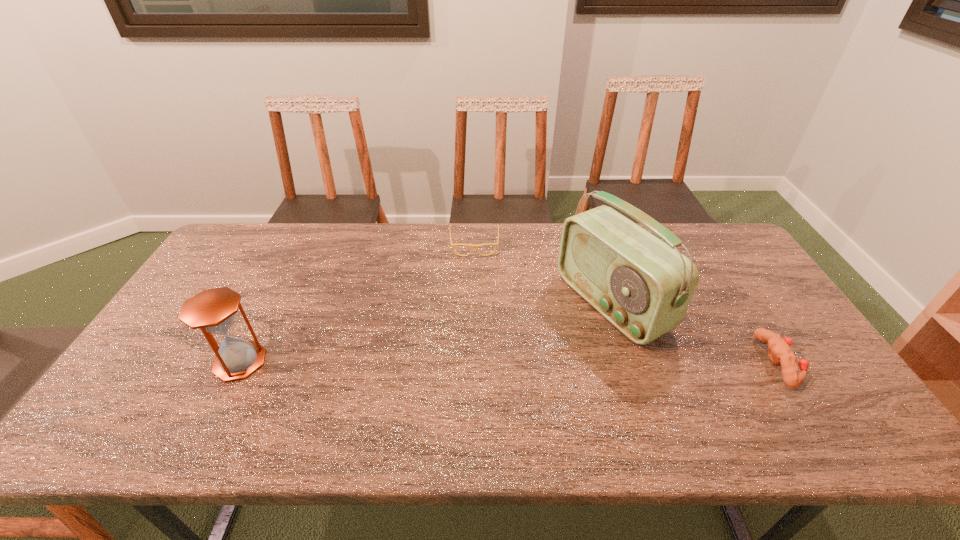
I want to click on vacant space that's between the hourglass and the third object from right to left, so click(357, 303).

At what (x,y) coordinates should I click in order to perform the action: click on free area in between the farthest object and the hourglass. Please return your answer as a coordinate pair (x, y). The width and height of the screenshot is (960, 540). Looking at the image, I should click on (357, 303).

The height and width of the screenshot is (540, 960). Identify the location of free space between the rightmost object and the radio receiver. (695, 333).

Identify the location of free space between the hourglass and the second shortest object. The width and height of the screenshot is (960, 540). (509, 362).

Where is `empty space between the leftmost object and the farthest object`? Image resolution: width=960 pixels, height=540 pixels. empty space between the leftmost object and the farthest object is located at coordinates (357, 303).

In order to click on vacant space that's between the puncher and the second tallest object in this screenshot , I will do `click(509, 362)`.

At what (x,y) coordinates should I click in order to perform the action: click on object that is the closest to the second tallest object. Please return your answer as a coordinate pair (x, y). The image size is (960, 540). Looking at the image, I should click on (496, 244).

Find the location of `object that ranks as the second closest to the second object from right to left`. object that ranks as the second closest to the second object from right to left is located at coordinates (779, 351).

The image size is (960, 540). Find the location of `free spot that satisfies the following two spatial constraints: 1. on the front side of the second shortest object; 2. with the gloves of the third object from right to left facing forward`. free spot that satisfies the following two spatial constraints: 1. on the front side of the second shortest object; 2. with the gloves of the third object from right to left facing forward is located at coordinates (472, 362).

This screenshot has height=540, width=960. Identify the location of vacant point that satisfies the following two spatial constraints: 1. on the back side of the hourglass; 2. on the right side of the second object from right to left. (270, 303).